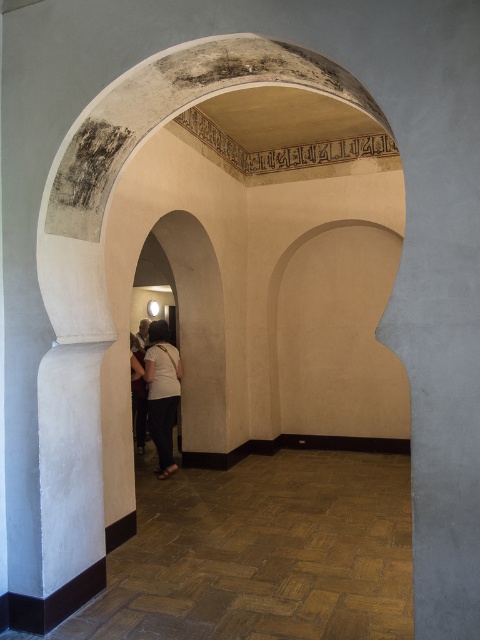
Question: Can you confirm if brown parquet floor at lower center is smaller than white cotton shirt at center?

Choices:
 (A) no
 (B) yes

Answer: (A)

Question: Can you confirm if brown parquet floor at lower center is positioned above white cotton shirt at center?

Choices:
 (A) yes
 (B) no

Answer: (B)

Question: Can you confirm if brown parquet floor at lower center is smaller than white cotton shirt at center?

Choices:
 (A) no
 (B) yes

Answer: (A)

Question: Which of the following is the farthest from the observer?

Choices:
 (A) white cotton shirt at center
 (B) brown parquet floor at lower center

Answer: (A)